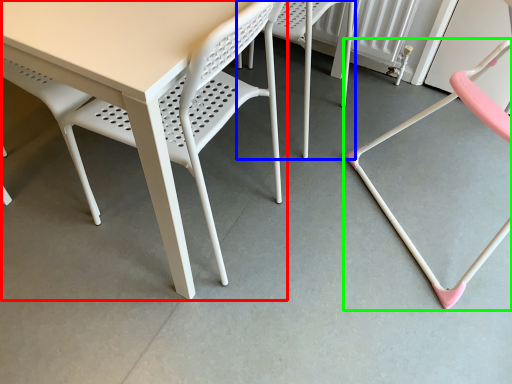
Question: Estimate the real-world distances between objects in this image. Which object is closer to table (highlighted by a red box), chair (highlighted by a blue box) or chair (highlighted by a green box)?

Choices:
 (A) chair
 (B) chair

Answer: (A)